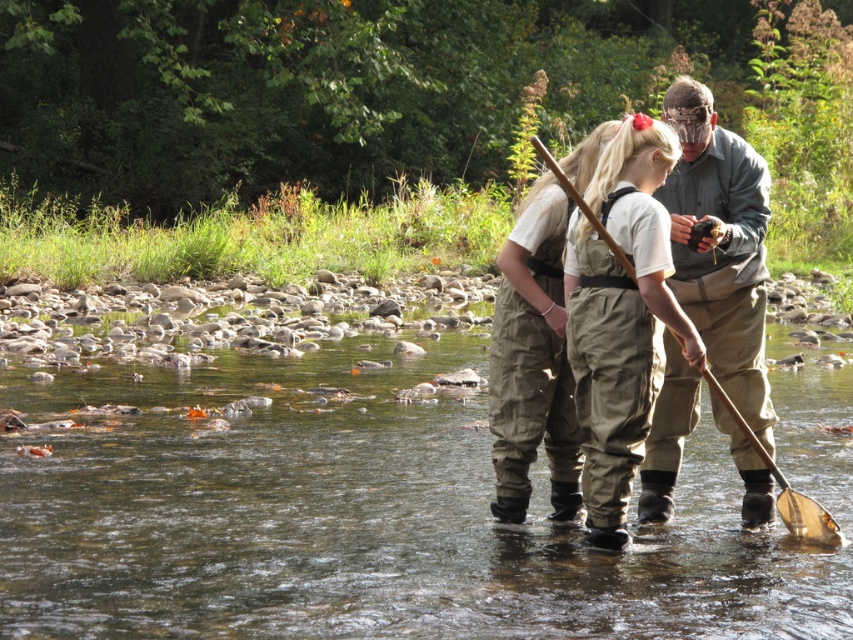
You are planning to cross the river using the wooden paddle at center. The clear water at river center is wider than the paddle. Will the paddle be long enough to help you cross the river?

The clear water at river center is wider than the wooden paddle at center, so the paddle may not be long enough to span the river width. Consider using a longer tool or alternative method to cross safely.